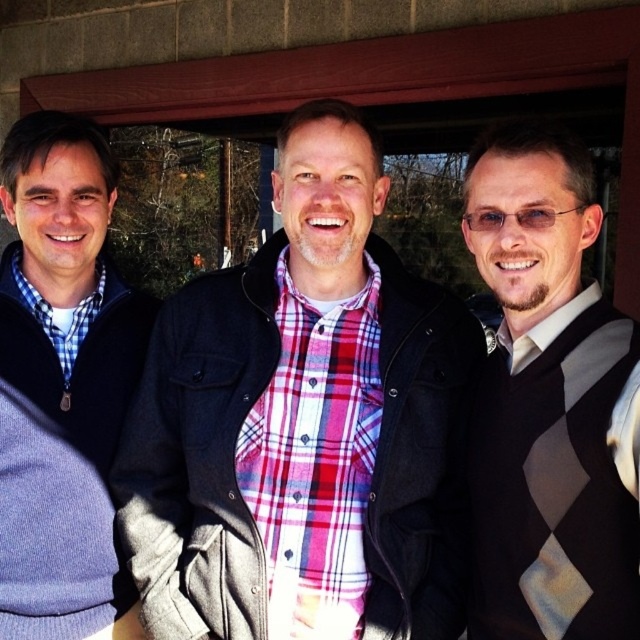
Question: Can you confirm if plaid shirt at center is bigger than argyle sweater vest at right?

Choices:
 (A) no
 (B) yes

Answer: (B)

Question: Is plaid shirt at center positioned behind matte black sweater at left?

Choices:
 (A) yes
 (B) no

Answer: (B)

Question: Which point is closer to the camera?

Choices:
 (A) (20, 163)
 (B) (580, 438)

Answer: (B)

Question: In this image, where is argyle sweater vest at right located relative to matte black sweater at left?

Choices:
 (A) above
 (B) below

Answer: (B)

Question: Considering the real-world distances, which object is farthest from the argyle sweater vest at right?

Choices:
 (A) matte black sweater at left
 (B) plaid shirt at center

Answer: (A)

Question: Estimate the real-world distances between objects in this image. Which object is farther from the matte black sweater at left?

Choices:
 (A) plaid shirt at center
 (B) argyle sweater vest at right

Answer: (B)